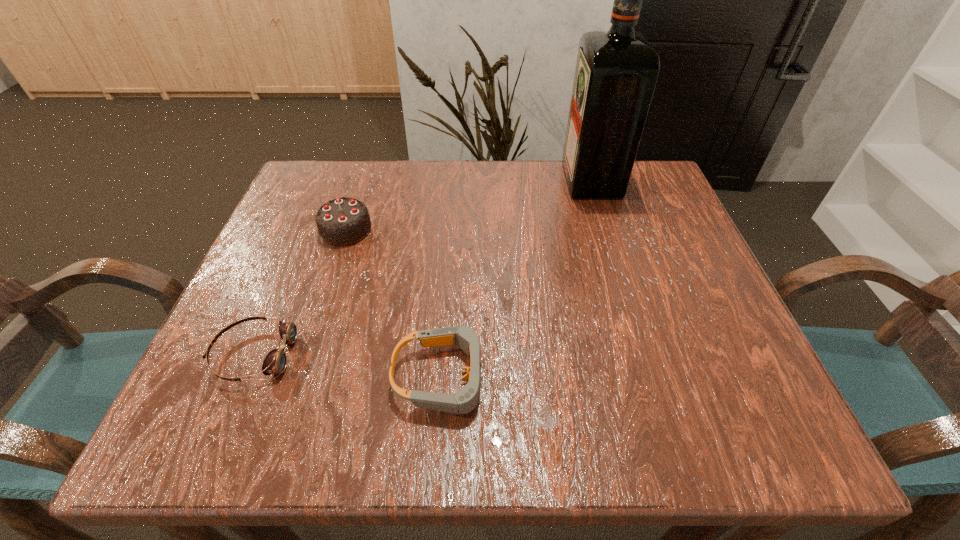
The image size is (960, 540). Identify the location of vacant space located on the front label of the rightmost object. (512, 180).

Where is `vacant region located on the left of the chocolate cake`? Image resolution: width=960 pixels, height=540 pixels. vacant region located on the left of the chocolate cake is located at coordinates (274, 230).

The image size is (960, 540). What are the coordinates of `free space located 0.060m on the front and back of the second shortest object` in the screenshot? It's located at (533, 377).

Identify the location of free spot located 0.180m through the lenses of the shortest object. This screenshot has width=960, height=540. (402, 354).

Where is `liquor positioned at the far edge`? liquor positioned at the far edge is located at coordinates (616, 72).

Locate an element on the screen. This screenshot has height=540, width=960. chocolate cake that is at the far edge is located at coordinates (343, 221).

Where is `object located at the near edge`? The width and height of the screenshot is (960, 540). object located at the near edge is located at coordinates (466, 399).

This screenshot has width=960, height=540. I want to click on chocolate cake that is at the left edge, so click(x=343, y=221).

Where is `goggles at the left edge`? goggles at the left edge is located at coordinates (275, 362).

Where is `object that is at the right edge`? The image size is (960, 540). object that is at the right edge is located at coordinates (616, 72).